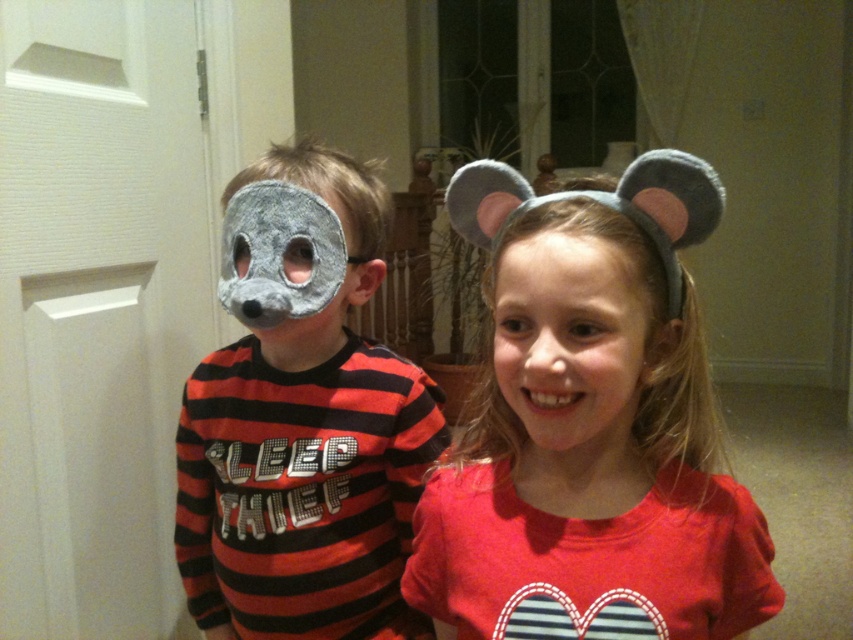
Question: Considering the real-world distances, which object is farthest from the felt gray mask at left?

Choices:
 (A) matte gray headband with ears at center
 (B) smooth skin face at center

Answer: (B)

Question: Which point is closer to the camera taking this photo?

Choices:
 (A) (627, 310)
 (B) (346, 387)
 (C) (537, 321)

Answer: (C)

Question: Which point appears closest to the camera in this image?

Choices:
 (A) (643, 307)
 (B) (630, 481)
 (C) (387, 612)

Answer: (A)

Question: Can you confirm if matte gray headband with ears at center is positioned below smooth skin face at center?

Choices:
 (A) yes
 (B) no

Answer: (A)

Question: Can you confirm if matte gray headband with ears at center is positioned below smooth skin face at center?

Choices:
 (A) yes
 (B) no

Answer: (A)

Question: Does matte gray headband with ears at center appear on the right side of felt gray mask at left?

Choices:
 (A) no
 (B) yes

Answer: (B)